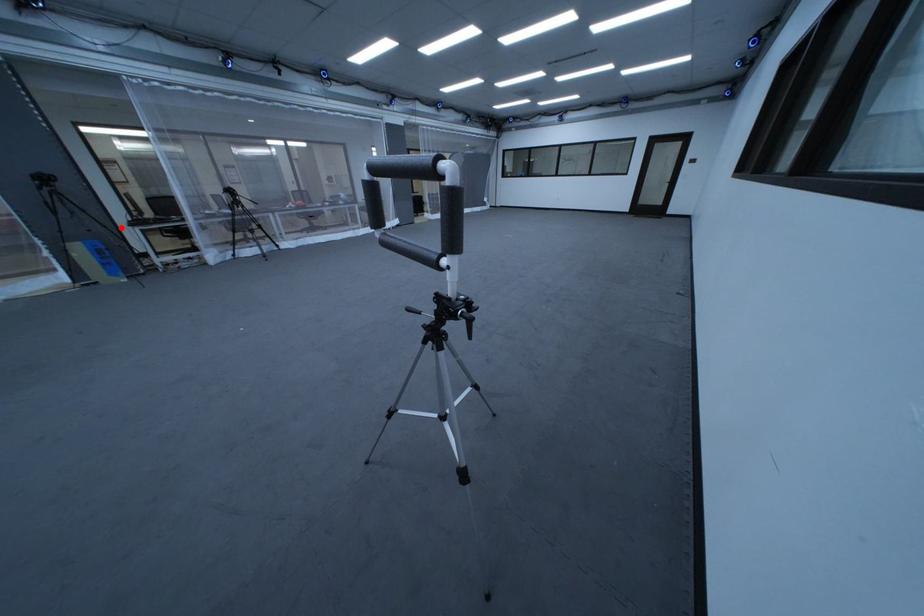
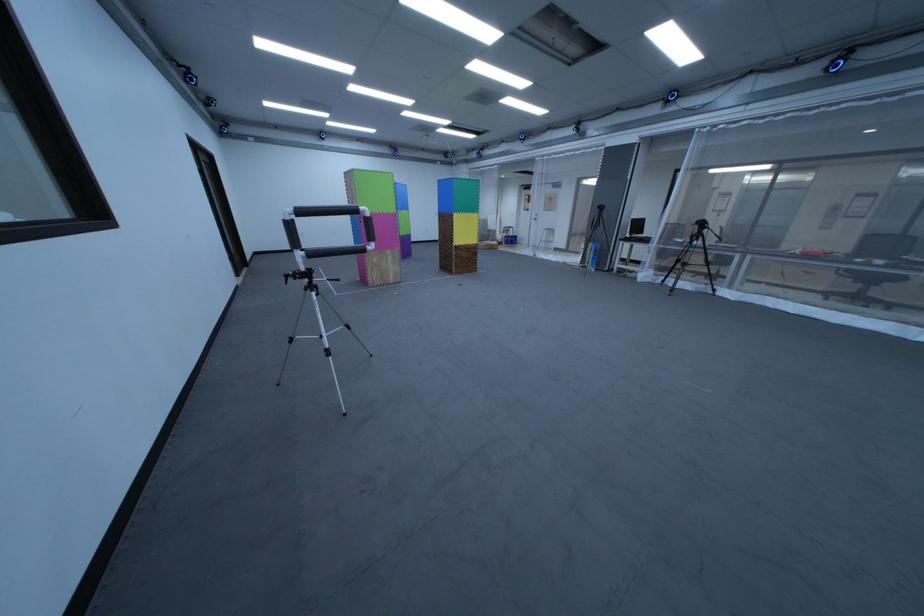
Locate, in the second image, the point that corresponds to the highlighted location in the first image.

(623, 238)